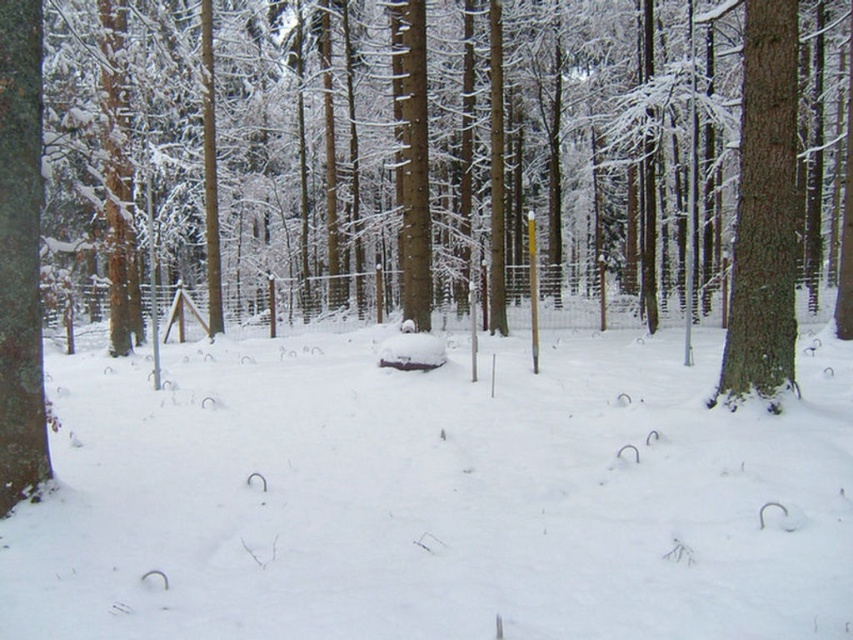
Question: Can you confirm if smooth bark tree at right is smaller than smooth brown tree trunk at left?

Choices:
 (A) yes
 (B) no

Answer: (B)

Question: Which point appears farthest from the camera in this image?

Choices:
 (A) (790, 208)
 (B) (15, 410)

Answer: (A)

Question: Estimate the real-world distances between objects in this image. Which object is farther from the smooth bark tree at right?

Choices:
 (A) smooth brown tree trunk at left
 (B) white fluffy snow at center

Answer: (A)

Question: Is smooth bark tree at right to the right of smooth brown tree trunk at left from the viewer's perspective?

Choices:
 (A) no
 (B) yes

Answer: (B)

Question: Where is smooth bark tree at right located in relation to smooth brown tree trunk at left in the image?

Choices:
 (A) left
 (B) right

Answer: (B)

Question: Which object is the farthest from the smooth bark tree at right?

Choices:
 (A) white fluffy snow at center
 (B) smooth brown tree trunk at left

Answer: (B)